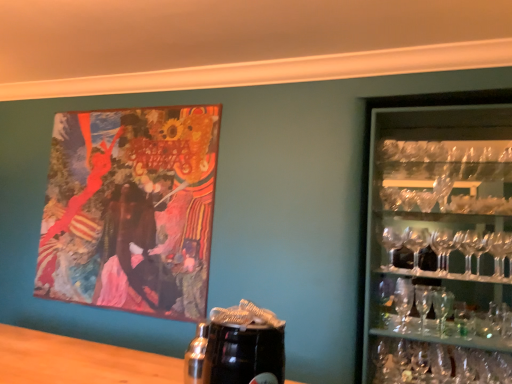
Identify the location of clear glass martini glass at right. (442, 307).

Identify the location of oil painting at upper left. The width and height of the screenshot is (512, 384). (131, 210).

At what (x,y) coordinates should I click in order to perform the action: click on transparent glassware at right. Please return your answer as a coordinate pair (x, y). Looking at the image, I should click on (439, 238).

Based on the photo, which is closer, (91, 173) or (484, 259)?

The point (484, 259) is more forward.

From the image's perspective, which object appears higher, oil painting at upper left or transparent glassware at right?

oil painting at upper left.

Considering the positions of objects oil painting at upper left and transparent glassware at right in the image provided, who is more to the right, oil painting at upper left or transparent glassware at right?

transparent glassware at right.

Is oil painting at upper left positioned behind transparent glassware at right?

Yes, it is.

Consider the image. Considering the sizes of objects oil painting at upper left and clear glass martini glass at right in the image provided, who is taller, oil painting at upper left or clear glass martini glass at right?

Standing taller between the two is oil painting at upper left.

How different are the orientations of oil painting at upper left and clear glass martini glass at right in degrees?

There is a 0.291-degree angle between the facing directions of oil painting at upper left and clear glass martini glass at right.

From the image's perspective, is oil painting at upper left located beneath clear glass martini glass at right?

No, from the image's perspective, oil painting at upper left is not beneath clear glass martini glass at right.

Considering the relative positions of oil painting at upper left and clear glass martini glass at right in the image provided, is oil painting at upper left to the left or to the right of clear glass martini glass at right?

In the image, oil painting at upper left appears on the left side of clear glass martini glass at right.

From the image's perspective, between transparent glassware at right and clear glass martini glass at right, who is located below?

clear glass martini glass at right is shown below in the image.

Locate an element on the screen. The image size is (512, 384). shelf positioned vertically above the clear glass martini glass at right (from a real-world perspective) is located at coordinates (439, 238).

Does transparent glassware at right turn towards clear glass martini glass at right?

Yes, transparent glassware at right is oriented towards clear glass martini glass at right.

Choose the correct answer: Is transparent glassware at right inside clear glass martini glass at right or outside it?

transparent glassware at right is not enclosed by clear glass martini glass at right.

Which of these two, clear glass martini glass at right or oil painting at upper left, stands taller?

Standing taller between the two is oil painting at upper left.

Visually, is clear glass martini glass at right positioned to the left or to the right of oil painting at upper left?

Clearly, clear glass martini glass at right is on the right of oil painting at upper left in the image.

Image resolution: width=512 pixels, height=384 pixels. Identify the location of picture frame located above the clear glass martini glass at right (from a real-world perspective). (131, 210).

Is clear glass martini glass at right directly adjacent to oil painting at upper left?

No, clear glass martini glass at right is not with oil painting at upper left.

In the scene shown: Considering the relative positions of transparent glassware at right and oil painting at upper left in the image provided, is transparent glassware at right to the right of oil painting at upper left from the viewer's perspective?

Yes.

From the image's perspective, who appears lower, transparent glassware at right or oil painting at upper left?

transparent glassware at right.

From a real-world perspective, is transparent glassware at right below oil painting at upper left?

Yes, from a real-world perspective, transparent glassware at right is below oil painting at upper left.

Does clear glass martini glass at right touch transparent glassware at right?

No, clear glass martini glass at right is not in contact with transparent glassware at right.

At what (x,y) coordinates should I click in order to perform the action: click on martini glass on the left of the transparent glassware at right. Please return your answer as a coordinate pair (x, y). Looking at the image, I should click on (442, 307).

How much distance is there between clear glass martini glass at right and transparent glassware at right?

clear glass martini glass at right and transparent glassware at right are 39.27 centimeters apart from each other.

Is clear glass martini glass at right positioned with its back to transparent glassware at right?

That's right, clear glass martini glass at right is facing away from transparent glassware at right.

Find the location of a particular element. shelf on the right of the oil painting at upper left is located at coordinates (439, 238).

You are a GUI agent. You are given a task and a screenshot of the screen. Output one action in this format:
    pyautogui.click(x=<x>, y=<y>)
    Task: Click on the picture frame above the clear glass martini glass at right (from a real-world perspective)
    Image resolution: width=512 pixels, height=384 pixels.
    Given the screenshot: What is the action you would take?
    pyautogui.click(x=131, y=210)

Estimate the real-world distances between objects in this image. Which object is closer to oil painting at upper left, clear glass martini glass at right or transparent glassware at right?

Among the two, transparent glassware at right is located nearer to oil painting at upper left.

Estimate the real-world distances between objects in this image. Which object is closer to clear glass martini glass at right, oil painting at upper left or transparent glassware at right?

transparent glassware at right.

Based on their spatial positions, is oil painting at upper left or clear glass martini glass at right closer to transparent glassware at right?

clear glass martini glass at right.

Looking at the image, which one is located further to transparent glassware at right, clear glass martini glass at right or oil painting at upper left?

oil painting at upper left is further to transparent glassware at right.

Looking at the image, which one is located further to clear glass martini glass at right, transparent glassware at right or oil painting at upper left?

oil painting at upper left is positioned further to the anchor clear glass martini glass at right.

Which object lies further to the anchor point oil painting at upper left, transparent glassware at right or clear glass martini glass at right?

clear glass martini glass at right.

The height and width of the screenshot is (384, 512). Find the location of `martini glass situated between oil painting at upper left and transparent glassware at right from left to right`. martini glass situated between oil painting at upper left and transparent glassware at right from left to right is located at coordinates (442, 307).